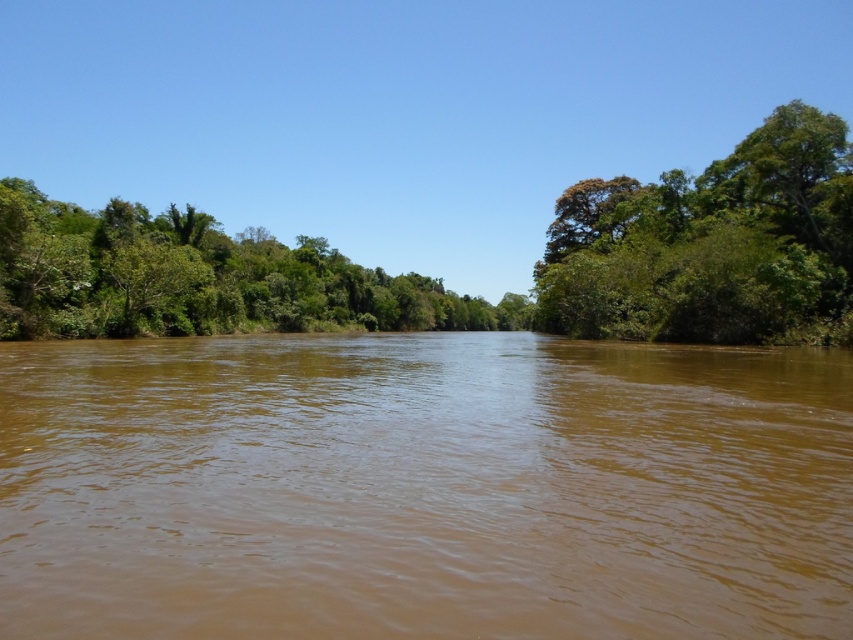
Which is behind, point (616, 326) or point (397, 296)?

The point (397, 296) is more distant.

Can you confirm if green leafy tree at right is positioned to the right of green leafy trees at left?

Indeed, green leafy tree at right is positioned on the right side of green leafy trees at left.

Who is more distant from viewer, (643,296) or (184,236)?

The point (184,236) is behind.

Image resolution: width=853 pixels, height=640 pixels. I want to click on green leafy tree at right, so click(709, 243).

Image resolution: width=853 pixels, height=640 pixels. Describe the element at coordinates (422, 488) in the screenshot. I see `brown muddy water at center` at that location.

Does point (364, 385) come in front of point (689, 305)?

That is True.

The height and width of the screenshot is (640, 853). I want to click on brown muddy water at center, so click(422, 488).

Is brown muddy water at center positioned behind green leafy trees at left?

No, brown muddy water at center is closer to the viewer.

Does brown muddy water at center appear under green leafy trees at left?

Indeed, brown muddy water at center is positioned under green leafy trees at left.

In order to click on brown muddy water at center in this screenshot , I will do `click(422, 488)`.